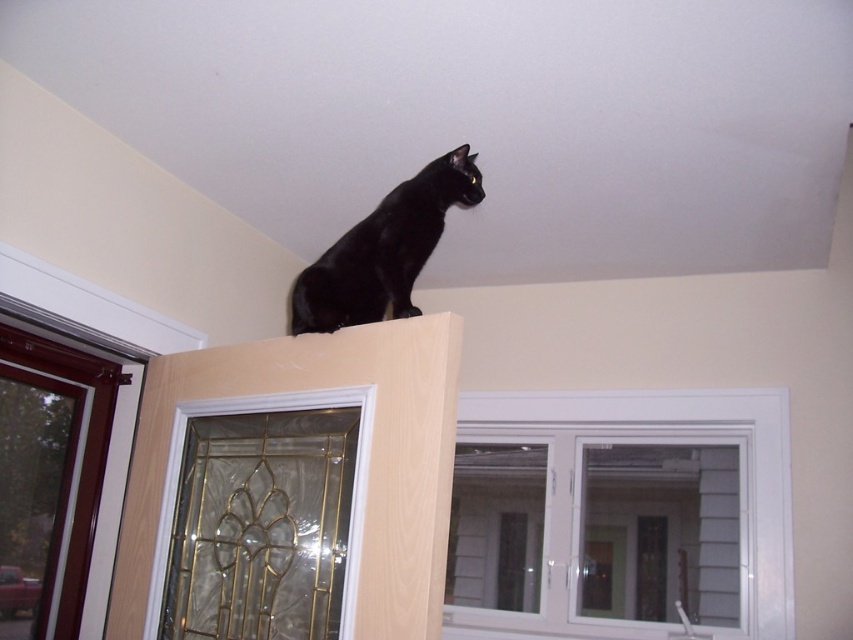
Is white plastic window at upper center shorter than matte black cat at upper center?

No, white plastic window at upper center is not shorter than matte black cat at upper center.

Is white plastic window at upper center further to the viewer compared to matte black cat at upper center?

Yes, it is behind matte black cat at upper center.

Image resolution: width=853 pixels, height=640 pixels. I want to click on white plastic window at upper center, so click(677, 442).

Is the position of matte black cat at upper center less distant than that of clear glass door at upper center?

That is False.

Who is taller, matte black cat at upper center or clear glass door at upper center?

With more height is clear glass door at upper center.

Is point (329, 260) farther from viewer compared to point (366, 444)?

Yes, point (329, 260) is farther from viewer.

At what (x,y) coordinates should I click in order to perform the action: click on matte black cat at upper center. Please return your answer as a coordinate pair (x, y). This screenshot has width=853, height=640. Looking at the image, I should click on (383, 250).

In the scene shown: Is white plastic window at upper center wider than clear glass door at upper center?

Yes.

Is white plastic window at upper center closer to the viewer compared to clear glass door at upper center?

No, white plastic window at upper center is further to the viewer.

Which is in front, point (492, 406) or point (345, 582)?

Positioned in front is point (345, 582).

Identify the location of white plastic window at upper center. Image resolution: width=853 pixels, height=640 pixels. (677, 442).